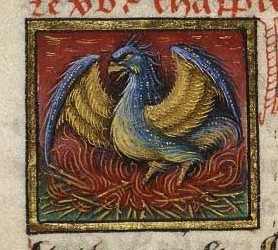
This screenshot has width=278, height=250. I want to click on bottom right gold corner of framed bird picture, so click(255, 222).